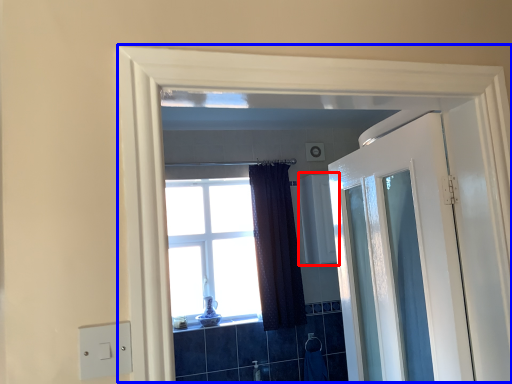
Question: Which of the following is the farthest to the observer, medicine cabinet (highlighted by a red box) or window frame (highlighted by a blue box)?

Choices:
 (A) medicine cabinet
 (B) window frame

Answer: (A)